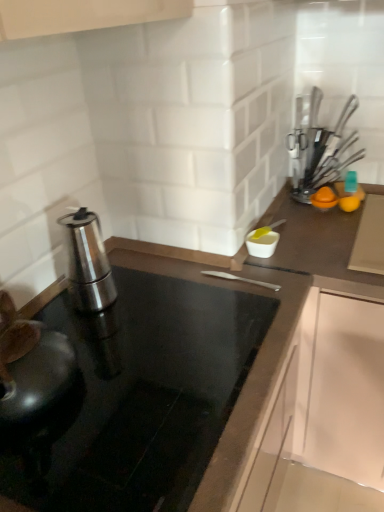
Question: Is the depth of metallic silver utensils at upper right, marked as the 2th kitchen appliance in a front-to-back arrangement, greater than that of polished stainless steel espresso maker at left, arranged as the second kitchen appliance when viewed from the top?

Choices:
 (A) yes
 (B) no

Answer: (A)

Question: From the image's perspective, is metallic silver utensils at upper right, acting as the first kitchen appliance starting from the top, on polished stainless steel espresso maker at left, the second kitchen appliance viewed from the right?

Choices:
 (A) yes
 (B) no

Answer: (A)

Question: From the image's perspective, is metallic silver utensils at upper right, which appears as the second kitchen appliance when ordered from the bottom, beneath polished stainless steel espresso maker at left, the second kitchen appliance viewed from the right?

Choices:
 (A) yes
 (B) no

Answer: (B)

Question: Considering the relative sizes of metallic silver utensils at upper right, arranged as the 2th kitchen appliance when viewed from the left, and polished stainless steel espresso maker at left, which is the 1th kitchen appliance in left-to-right order, in the image provided, is metallic silver utensils at upper right, arranged as the 2th kitchen appliance when viewed from the left, bigger than polished stainless steel espresso maker at left, which is the 1th kitchen appliance in left-to-right order,?

Choices:
 (A) yes
 (B) no

Answer: (B)

Question: Is metallic silver utensils at upper right, acting as the first kitchen appliance starting from the top, smaller than polished stainless steel espresso maker at left, arranged as the 2th kitchen appliance when viewed from the back?

Choices:
 (A) no
 (B) yes

Answer: (B)

Question: Is polished stainless steel espresso maker at left, the second kitchen appliance viewed from the right, to the left or to the right of metallic silver utensils at upper right, acting as the first kitchen appliance starting from the top, in the image?

Choices:
 (A) right
 (B) left

Answer: (B)

Question: Is polished stainless steel espresso maker at left, arranged as the 2th kitchen appliance when viewed from the back, spatially inside metallic silver utensils at upper right, which appears as the second kitchen appliance when ordered from the bottom, or outside of it?

Choices:
 (A) outside
 (B) inside

Answer: (A)

Question: Considering the positions of point (74, 253) and point (349, 115), is point (74, 253) closer or farther from the camera than point (349, 115)?

Choices:
 (A) farther
 (B) closer

Answer: (B)

Question: In terms of size, does polished stainless steel espresso maker at left, arranged as the second kitchen appliance when viewed from the top, appear bigger or smaller than metallic silver utensils at upper right, acting as the first kitchen appliance starting from the back?

Choices:
 (A) big
 (B) small

Answer: (A)

Question: Considering their positions, is metallic silver utensils at upper right, acting as the first kitchen appliance starting from the back, located in front of or behind black glass countertop at center?

Choices:
 (A) front
 (B) behind

Answer: (B)

Question: Do you think metallic silver utensils at upper right, marked as the 2th kitchen appliance in a front-to-back arrangement, is within black glass countertop at center, or outside of it?

Choices:
 (A) outside
 (B) inside

Answer: (A)

Question: Is metallic silver utensils at upper right, acting as the first kitchen appliance starting from the top, wider or thinner than black glass countertop at center?

Choices:
 (A) wide
 (B) thin

Answer: (B)

Question: In terms of size, does metallic silver utensils at upper right, acting as the first kitchen appliance starting from the top, appear bigger or smaller than black glass countertop at center?

Choices:
 (A) big
 (B) small

Answer: (B)

Question: Visually, is polished stainless steel espresso maker at left, arranged as the second kitchen appliance when viewed from the top, positioned to the left or to the right of black glass countertop at center?

Choices:
 (A) left
 (B) right

Answer: (A)

Question: Is polished stainless steel espresso maker at left, which is the first kitchen appliance from front to back, taller or shorter than black glass countertop at center?

Choices:
 (A) short
 (B) tall

Answer: (B)